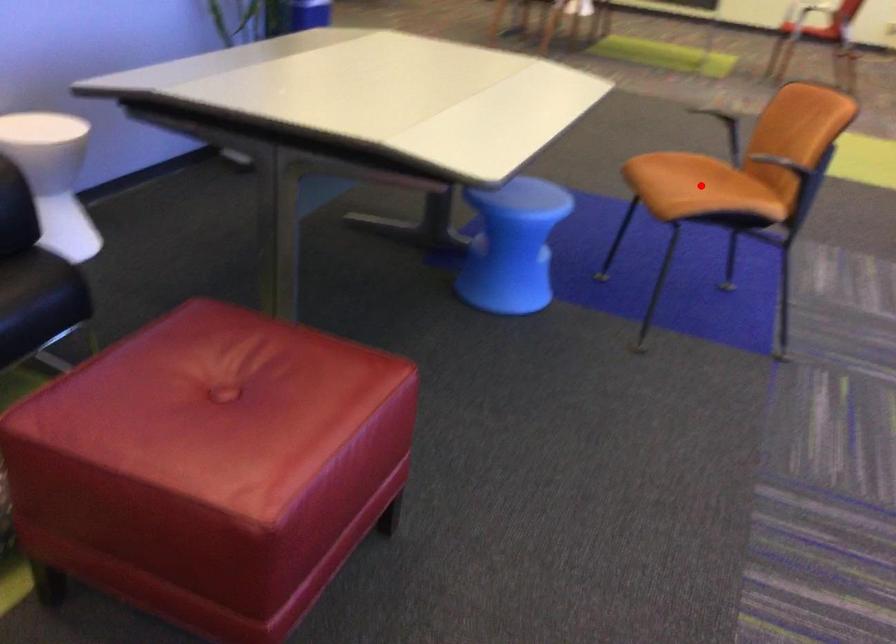
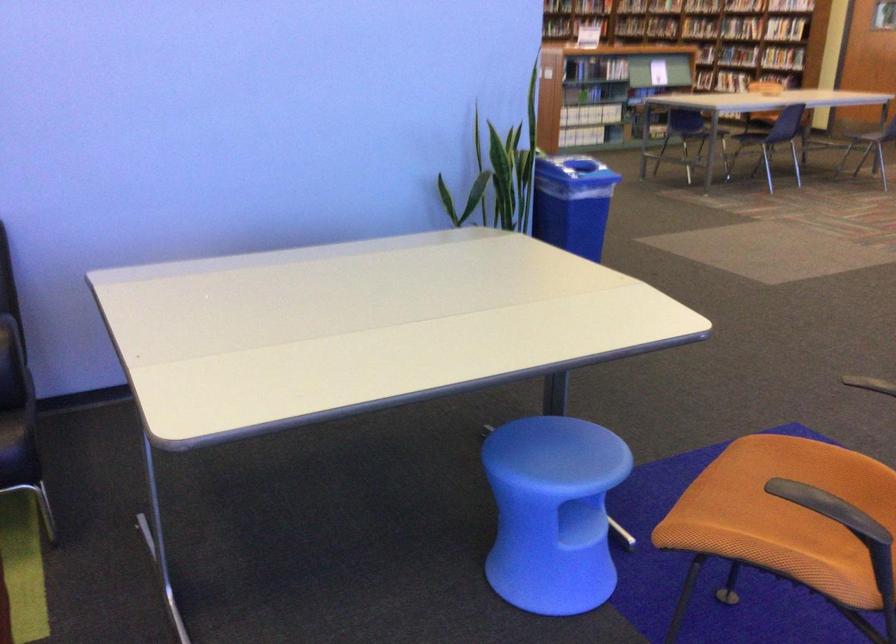
Question: I am providing you with two images of the same scene from different viewpoints. In image1, a red point is highlighted. Considering the same 3D point in image2, which of the following is correct?

Choices:
 (A) It is closer
 (B) It is farther

Answer: (A)